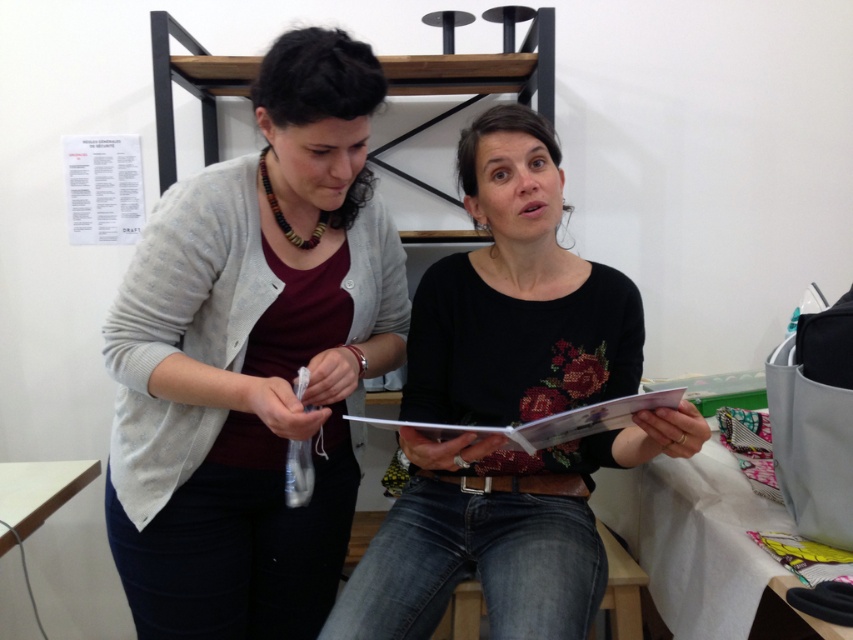
Is point (171, 212) positioned after point (515, 298)?

No, (171, 212) is closer to viewer.

Is matte gray cardigan at center to the right of black matte shirt at center from the viewer's perspective?

Incorrect, matte gray cardigan at center is not on the right side of black matte shirt at center.

Is point (396, 333) closer to camera compared to point (614, 353)?

No, it is behind (614, 353).

You are a GUI agent. You are given a task and a screenshot of the screen. Output one action in this format:
    pyautogui.click(x=<x>, y=<y>)
    Task: Click on the matte gray cardigan at center
    The height and width of the screenshot is (640, 853).
    Given the screenshot: What is the action you would take?
    pyautogui.click(x=253, y=358)